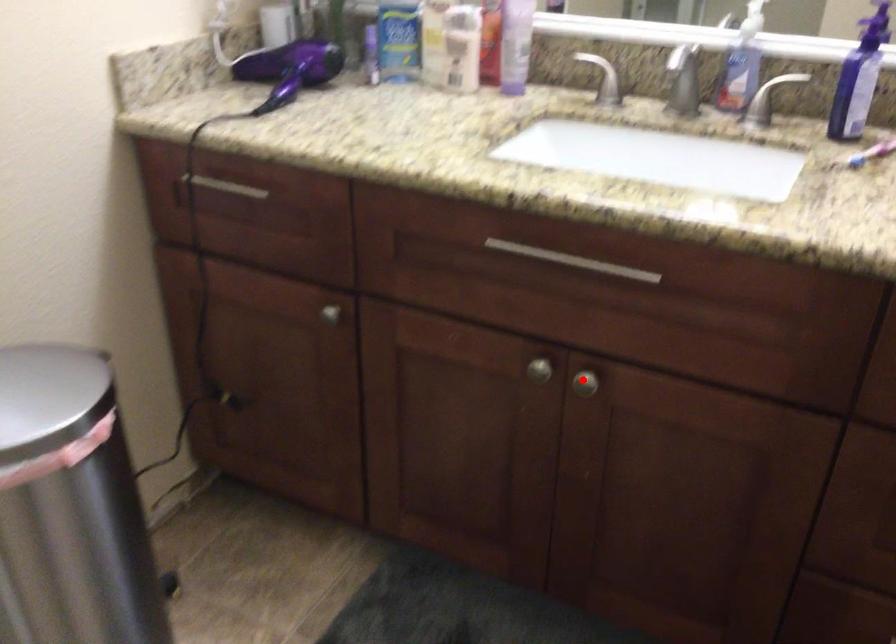
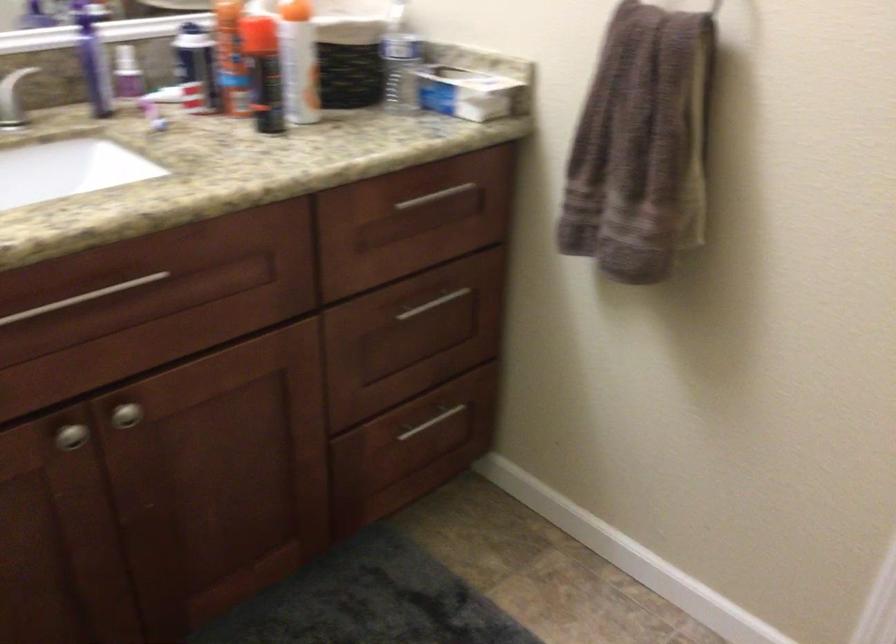
Where in the second image is the point corresponding to the highlighted location from the first image?

(125, 415)